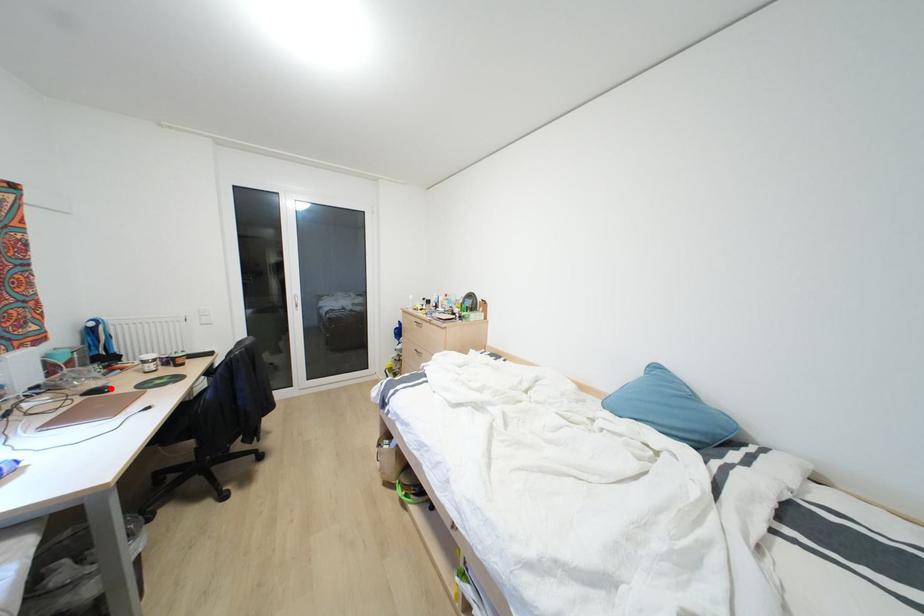
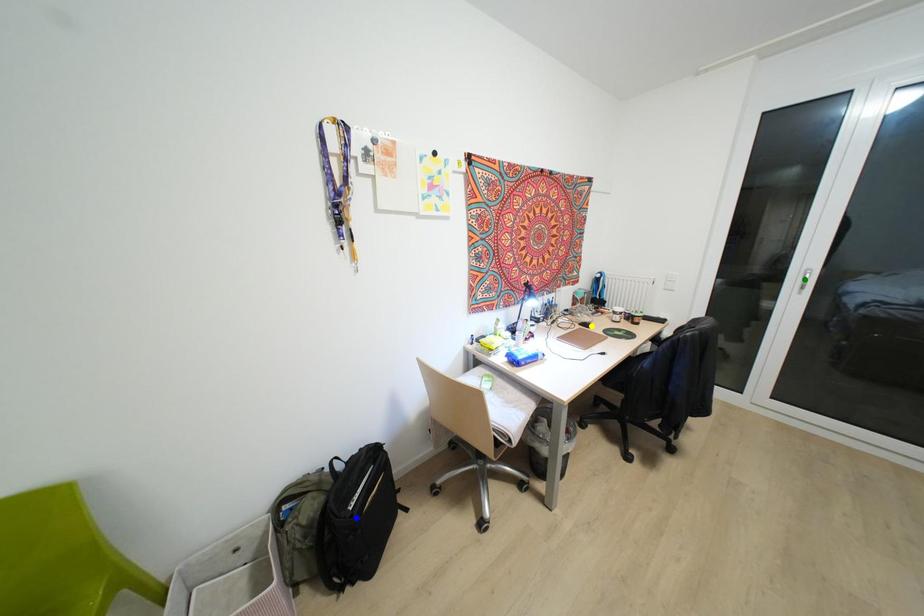
Question: I am providing you with two images of the same scene from different viewpoints. A red point is marked on the first image. You are given multiple points on the second image. Which mark in image 2 goes with the point in image 1?

Choices:
 (A) blue point
 (B) green point
 (C) yellow point

Answer: (C)